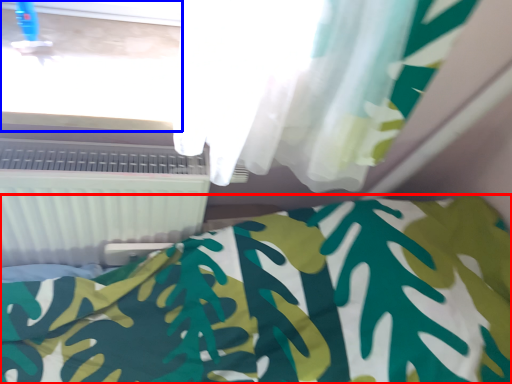
Question: Which point is further to the camera, bed (highlighted by a red box) or window frame (highlighted by a blue box)?

Choices:
 (A) bed
 (B) window frame

Answer: (B)